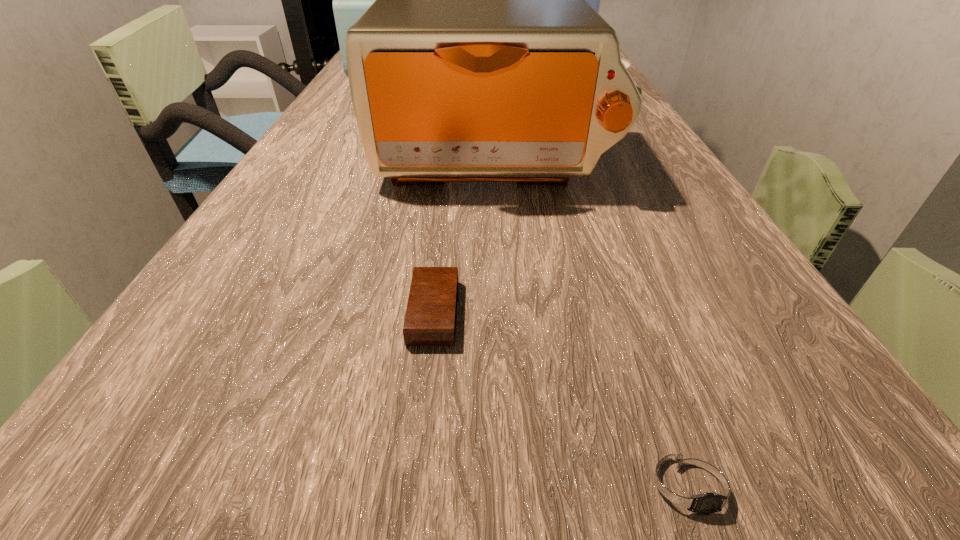
Identify the location of the tallest object. Image resolution: width=960 pixels, height=540 pixels. (594, 0).

Identify the location of toaster oven. The width and height of the screenshot is (960, 540). (480, 61).

This screenshot has width=960, height=540. What are the coordinates of `the second tallest object` in the screenshot? It's located at (480, 61).

This screenshot has width=960, height=540. Find the location of `radio receiver`. radio receiver is located at coordinates (350, 0).

At what (x,y) coordinates should I click in order to perform the action: click on soup bowl. Please return your answer as a coordinate pair (x, y). The width and height of the screenshot is (960, 540). Looking at the image, I should click on (627, 64).

Find the location of a particular element. The width and height of the screenshot is (960, 540). the fourth nearest object is located at coordinates (627, 64).

The width and height of the screenshot is (960, 540). In order to click on the second nearest object in this screenshot , I will do `click(430, 320)`.

Where is `free space located on the side of the tallest object with the handle`? The width and height of the screenshot is (960, 540). free space located on the side of the tallest object with the handle is located at coordinates (566, 92).

You are a GUI agent. You are given a task and a screenshot of the screen. Output one action in this format:
    pyautogui.click(x=<x>, y=<y>)
    Task: Click on the vacant area situated 0.080m on the door side of the second tallest object
    The image size is (960, 540).
    Given the screenshot: What is the action you would take?
    pyautogui.click(x=497, y=231)

Image resolution: width=960 pixels, height=540 pixels. I want to click on blank space located 0.380m on the front panel of the radio receiver, so click(572, 60).